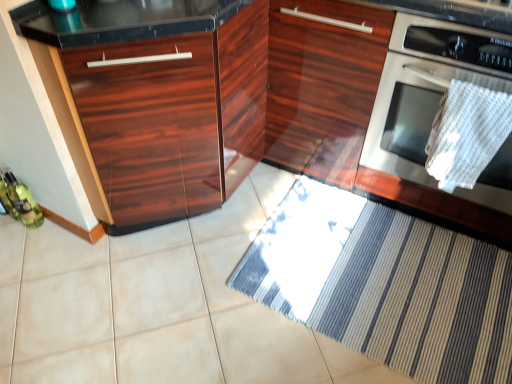
Image resolution: width=512 pixels, height=384 pixels. What do you see at coordinates (162, 98) in the screenshot?
I see `glossy wood cabinet at left, which ranks as the second cabinetry in right-to-left order` at bounding box center [162, 98].

Identify the location of striped fabric doormat at lower center. This screenshot has height=384, width=512. (385, 285).

What is the approximate width of glossy wood cabinet at center, the 2th cabinetry in the left-to-right sequence?

glossy wood cabinet at center, the 2th cabinetry in the left-to-right sequence, is 1.24 meters wide.

I want to click on stainless steel oven at right, so click(x=425, y=88).

Based on the photo, measure the distance between point [397,33] and camera.

A distance of 4.19 feet exists between point [397,33] and camera.

Measure the distance between point [481,92] and camera.

The distance of point [481,92] from camera is 1.22 meters.

The image size is (512, 384). Identify the location of green glass bottle at lower left. (23, 201).

Would you say glossy wood cabinet at left, marked as the 1th cabinetry in a left-to-right arrangement, is to the left or to the right of white woven towel at right in the picture?

glossy wood cabinet at left, marked as the 1th cabinetry in a left-to-right arrangement, is to the left of white woven towel at right.

Is glossy wood cabinet at left, which ranks as the second cabinetry in right-to-left order, taller or shorter than white woven towel at right?

glossy wood cabinet at left, which ranks as the second cabinetry in right-to-left order, is taller than white woven towel at right.

Can you confirm if glossy wood cabinet at left, which ranks as the second cabinetry in right-to-left order, is thinner than white woven towel at right?

No, glossy wood cabinet at left, which ranks as the second cabinetry in right-to-left order, is not thinner than white woven towel at right.

From the image's perspective, count 1st cabinetrys upward from the striped fabric doormat at lower center and point to it. Please provide its 2D coordinates.

[(162, 98)]

In the scene shown: From the image's perspective, does glossy wood cabinet at left, which ranks as the second cabinetry in right-to-left order, appear lower than striped fabric doormat at lower center?

No, from the image's perspective, glossy wood cabinet at left, which ranks as the second cabinetry in right-to-left order, is not below striped fabric doormat at lower center.

Is glossy wood cabinet at left, marked as the 1th cabinetry in a left-to-right arrangement, taller than striped fabric doormat at lower center?

Yes.

Which is more to the left, glossy wood cabinet at left, marked as the 1th cabinetry in a left-to-right arrangement, or striped fabric doormat at lower center?

Positioned to the left is glossy wood cabinet at left, marked as the 1th cabinetry in a left-to-right arrangement.

Looking at this image, who is bigger, glossy wood cabinet at center, positioned as the 1th cabinetry in right-to-left order, or green glass bottle at lower left?

glossy wood cabinet at center, positioned as the 1th cabinetry in right-to-left order.

Which is behind, point (165, 210) or point (26, 190)?

The point (26, 190) is farther.

Is the surface of glossy wood cabinet at center, positioned as the 1th cabinetry in right-to-left order, in direct contact with green glass bottle at lower left?

No, glossy wood cabinet at center, positioned as the 1th cabinetry in right-to-left order, is not beside green glass bottle at lower left.

Image resolution: width=512 pixels, height=384 pixels. I want to click on the 2nd cabinetry counting from the right side of the green glass bottle at lower left, so click(x=225, y=103).

Considering the sizes of objects stainless steel oven at right and glossy wood cabinet at left, which ranks as the second cabinetry in right-to-left order, in the image provided, who is thinner, stainless steel oven at right or glossy wood cabinet at left, which ranks as the second cabinetry in right-to-left order,?

glossy wood cabinet at left, which ranks as the second cabinetry in right-to-left order, is thinner.

In terms of height, does stainless steel oven at right look taller or shorter compared to glossy wood cabinet at left, marked as the 1th cabinetry in a left-to-right arrangement?

Considering their sizes, stainless steel oven at right has less height than glossy wood cabinet at left, marked as the 1th cabinetry in a left-to-right arrangement.

Consider the image. Is stainless steel oven at right not close to glossy wood cabinet at left, marked as the 1th cabinetry in a left-to-right arrangement?

No, stainless steel oven at right is not far from glossy wood cabinet at left, marked as the 1th cabinetry in a left-to-right arrangement.

Identify the location of cabinetry that is the 1st object above the stainless steel oven at right (from a real-world perspective). The height and width of the screenshot is (384, 512). (162, 98).

Locate an element on the screen. The height and width of the screenshot is (384, 512). bottle behind the glossy wood cabinet at center, positioned as the 1th cabinetry in right-to-left order is located at coordinates (23, 201).

How many degrees apart are the facing directions of green glass bottle at lower left and glossy wood cabinet at center, positioned as the 1th cabinetry in right-to-left order?

They differ by 89.1 degrees in their facing directions.

Does point (38, 212) come behind point (151, 85)?

Yes, it is behind point (151, 85).

Which of these two, green glass bottle at lower left or glossy wood cabinet at center, positioned as the 1th cabinetry in right-to-left order, stands shorter?

green glass bottle at lower left.

In the image, is stainless steel oven at right on the left side or the right side of white woven towel at right?

Based on their positions, stainless steel oven at right is located to the right of white woven towel at right.

From the image's perspective, which one is positioned lower, stainless steel oven at right or white woven towel at right?

white woven towel at right appears lower in the image.

Could you tell me if stainless steel oven at right is facing white woven towel at right?

Yes, stainless steel oven at right is facing white woven towel at right.

Are stainless steel oven at right and white woven towel at right making contact?

No, stainless steel oven at right is not in contact with white woven towel at right.

Is point (65, 69) positioned behind point (29, 213)?

That is False.

Which object is closer to the camera taking this photo, glossy wood cabinet at left, marked as the 1th cabinetry in a left-to-right arrangement, or green glass bottle at lower left?

glossy wood cabinet at left, marked as the 1th cabinetry in a left-to-right arrangement, is closer to the camera.

Could green glass bottle at lower left be considered to be inside glossy wood cabinet at left, which ranks as the second cabinetry in right-to-left order?

No, green glass bottle at lower left is not surrounded by glossy wood cabinet at left, which ranks as the second cabinetry in right-to-left order.

Locate an element on the screen. the 1st cabinetry in front of the white woven towel at right is located at coordinates (162, 98).

The height and width of the screenshot is (384, 512). Identify the location of the 1st cabinetry directly above the striped fabric doormat at lower center (from a real-world perspective). (162, 98).

In the scene shown: Which object lies further to the anchor point stainless steel oven at right, glossy wood cabinet at center, positioned as the 1th cabinetry in right-to-left order, or glossy wood cabinet at left, marked as the 1th cabinetry in a left-to-right arrangement?

glossy wood cabinet at left, marked as the 1th cabinetry in a left-to-right arrangement.

Based on their spatial positions, is glossy wood cabinet at center, the 2th cabinetry in the left-to-right sequence, or green glass bottle at lower left further from striped fabric doormat at lower center?

Among the two, green glass bottle at lower left is located further to striped fabric doormat at lower center.

Based on their spatial positions, is glossy wood cabinet at left, marked as the 1th cabinetry in a left-to-right arrangement, or stainless steel oven at right closer to glossy wood cabinet at center, positioned as the 1th cabinetry in right-to-left order?

glossy wood cabinet at left, marked as the 1th cabinetry in a left-to-right arrangement.

Looking at the image, which one is located closer to glossy wood cabinet at left, marked as the 1th cabinetry in a left-to-right arrangement, glossy wood cabinet at center, the 2th cabinetry in the left-to-right sequence, or stainless steel oven at right?

The object closer to glossy wood cabinet at left, marked as the 1th cabinetry in a left-to-right arrangement, is glossy wood cabinet at center, the 2th cabinetry in the left-to-right sequence.

Estimate the real-world distances between objects in this image. Which object is closer to striped fabric doormat at lower center, glossy wood cabinet at center, positioned as the 1th cabinetry in right-to-left order, or glossy wood cabinet at left, marked as the 1th cabinetry in a left-to-right arrangement?

glossy wood cabinet at center, positioned as the 1th cabinetry in right-to-left order.

Based on their spatial positions, is glossy wood cabinet at center, positioned as the 1th cabinetry in right-to-left order, or white woven towel at right further from green glass bottle at lower left?

white woven towel at right.

From the image, which object appears to be nearer to glossy wood cabinet at center, positioned as the 1th cabinetry in right-to-left order, green glass bottle at lower left or striped fabric doormat at lower center?

striped fabric doormat at lower center is positioned closer to the anchor glossy wood cabinet at center, positioned as the 1th cabinetry in right-to-left order.

Which object lies further to the anchor point stainless steel oven at right, glossy wood cabinet at left, marked as the 1th cabinetry in a left-to-right arrangement, or glossy wood cabinet at center, the 2th cabinetry in the left-to-right sequence?

Based on the image, glossy wood cabinet at left, marked as the 1th cabinetry in a left-to-right arrangement, appears to be further to stainless steel oven at right.

You are a GUI agent. You are given a task and a screenshot of the screen. Output one action in this format:
    pyautogui.click(x=<x>, y=<y>)
    Task: Click on the doormat situated between glossy wood cabinet at left, marked as the 1th cabinetry in a left-to-right arrangement, and white woven towel at right from left to right
    
    Given the screenshot: What is the action you would take?
    pyautogui.click(x=385, y=285)

Identify the location of blanket between stainless steel oven at right and striped fabric doormat at lower center vertically. (467, 133).

This screenshot has width=512, height=384. Identify the location of cabinetry between glossy wood cabinet at left, marked as the 1th cabinetry in a left-to-right arrangement, and stainless steel oven at right, in the horizontal direction. (225, 103).

Locate an element on the screen. This screenshot has width=512, height=384. doormat situated between glossy wood cabinet at center, positioned as the 1th cabinetry in right-to-left order, and stainless steel oven at right from left to right is located at coordinates (385, 285).